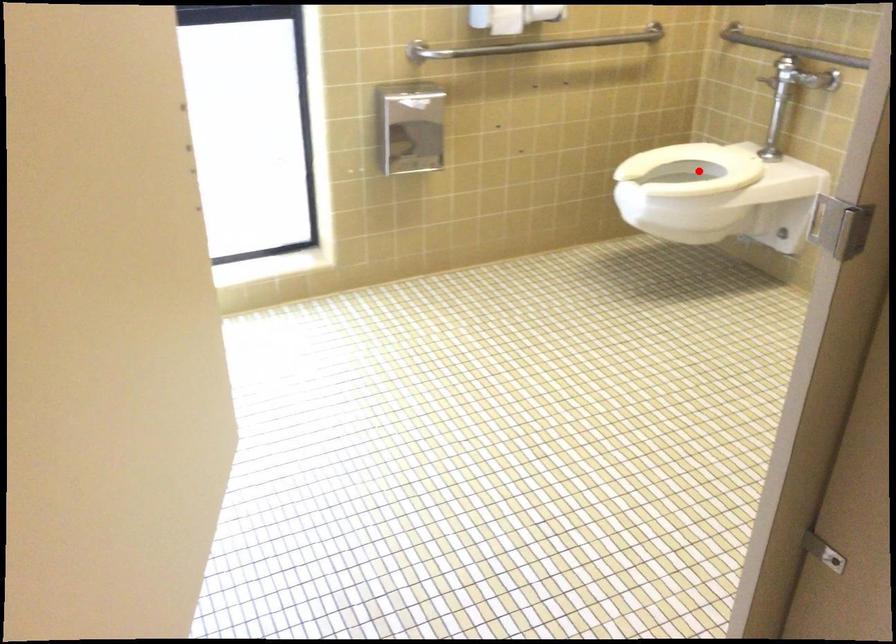
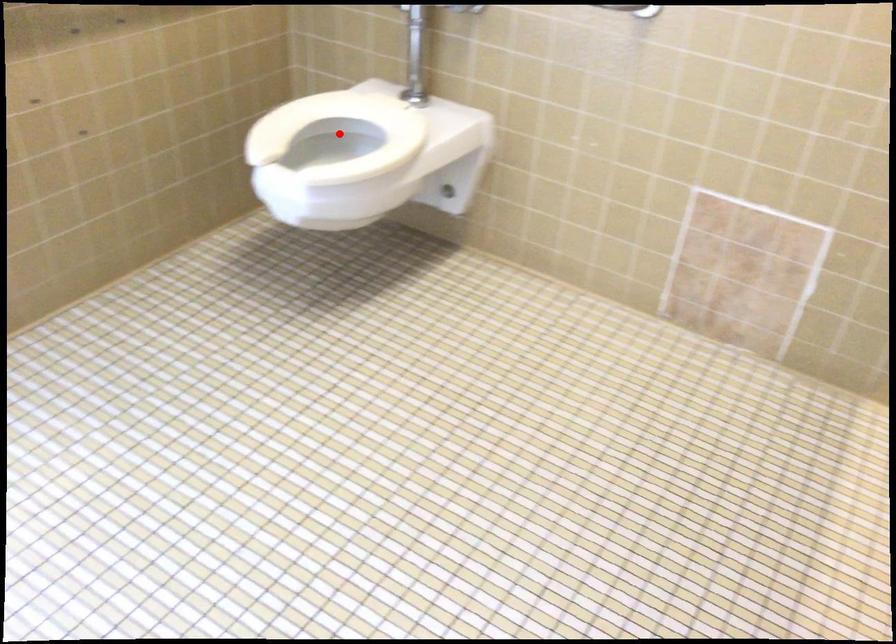
I am providing you with two images of the same scene from different viewpoints. A red point is marked on the first image and another point is marked on the second image. Do the highlighted points in image1 and image2 indicate the same real-world spot?

Yes